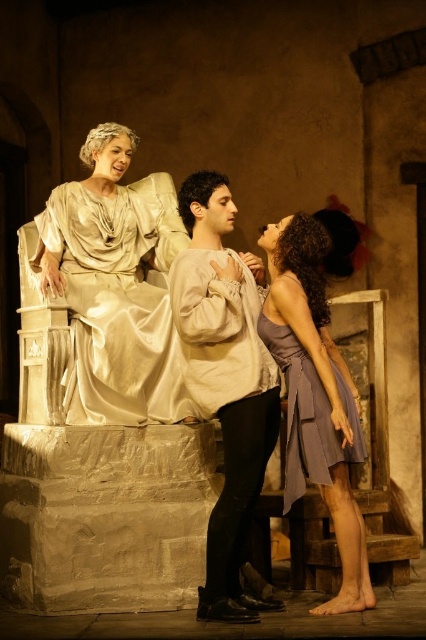
Does matte white shirt at center have a lesser width compared to matte purple dress at center?

In fact, matte white shirt at center might be wider than matte purple dress at center.

Measure the distance between point (261, 465) and camera.

Point (261, 465) and camera are 91.32 feet apart.

The width and height of the screenshot is (426, 640). I want to click on matte white shirt at center, so click(x=226, y=380).

Is satin dress at upper left above matte purple dress at center?

Yes.

Can you confirm if satin dress at upper left is wider than matte purple dress at center?

Indeed, satin dress at upper left has a greater width compared to matte purple dress at center.

Between point (69, 403) and point (298, 310), which one is positioned in front?

Positioned in front is point (69, 403).

Identify the location of satin dress at upper left. This screenshot has width=426, height=640. (115, 288).

Does satin dress at upper left have a larger size compared to matte white shirt at center?

Correct, satin dress at upper left is larger in size than matte white shirt at center.

I want to click on satin dress at upper left, so click(115, 288).